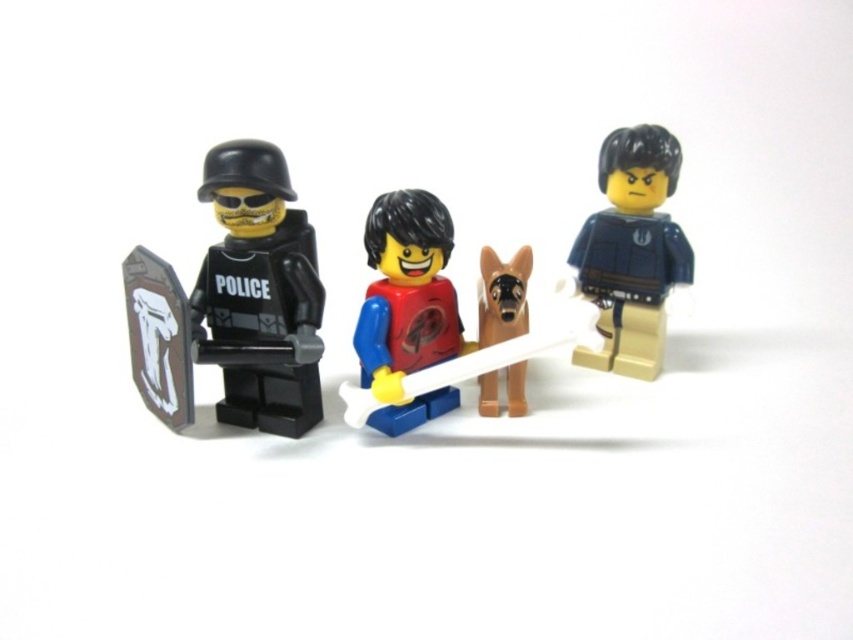
Between blue matte shirt at center and smooth plastic figure at center, which one has less height?

With less height is smooth plastic figure at center.

Does blue matte shirt at center have a greater width compared to smooth plastic figure at center?

Yes, blue matte shirt at center is wider than smooth plastic figure at center.

Identify the location of blue matte shirt at center. click(631, 250).

Is matte black police officer at left thinner than smooth plastic figure at center?

No.

Is matte black police officer at left behind smooth plastic figure at center?

That is False.

Which is in front, point (308, 408) or point (432, 413)?

Point (308, 408) is in front.

Locate an element on the screen. matte black police officer at left is located at coordinates (234, 304).

Is matte black police officer at left smaller than brown matte dog at center?

No.

Locate an element on the screen. The width and height of the screenshot is (853, 640). matte black police officer at left is located at coordinates (234, 304).